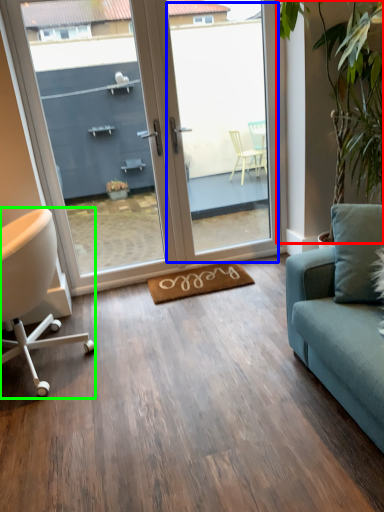
Question: Which object is positioned farthest from plant (highlighted by a red box)? Select from window screen (highlighted by a blue box) and chair (highlighted by a green box).

Choices:
 (A) window screen
 (B) chair

Answer: (B)